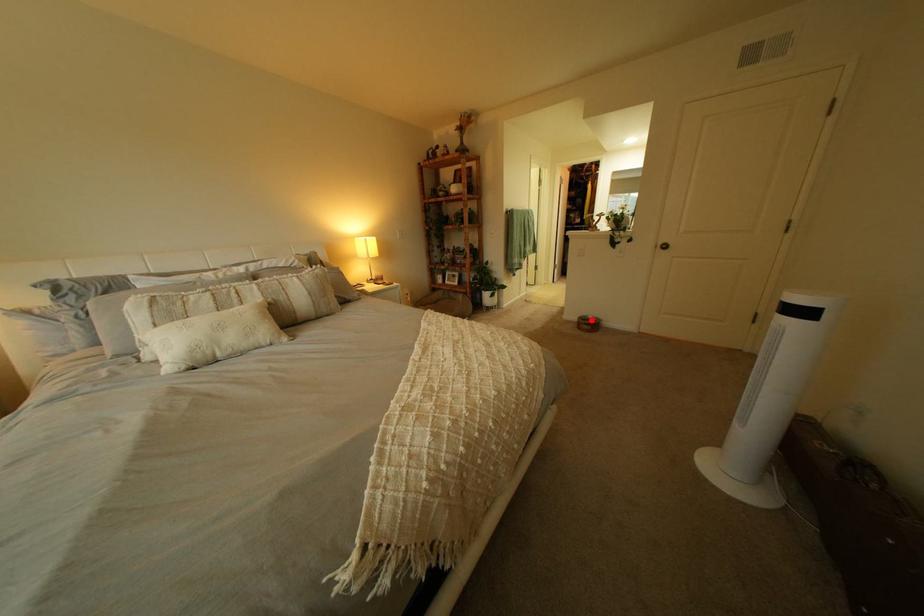
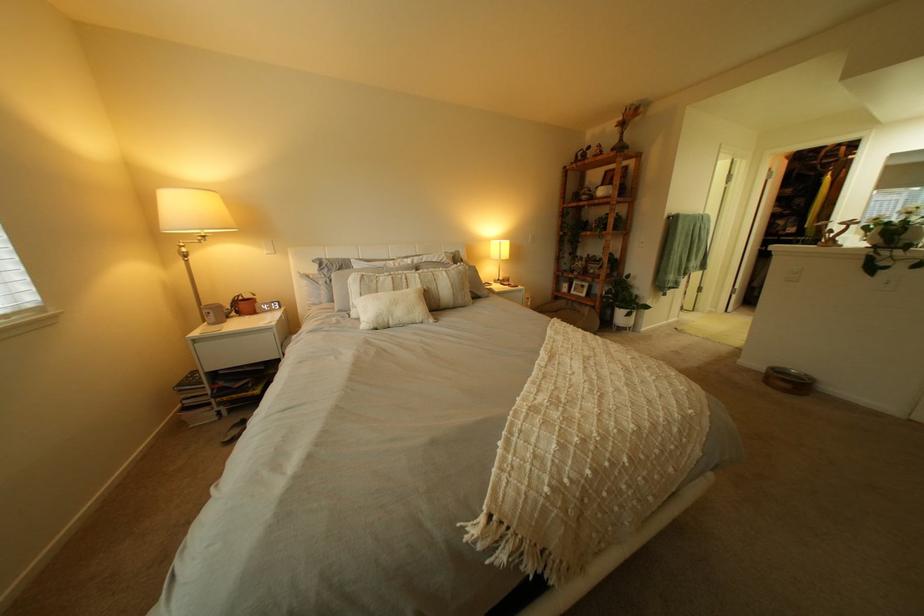
In the second image, find the point that corresponds to the highlighted location in the first image.

(779, 369)